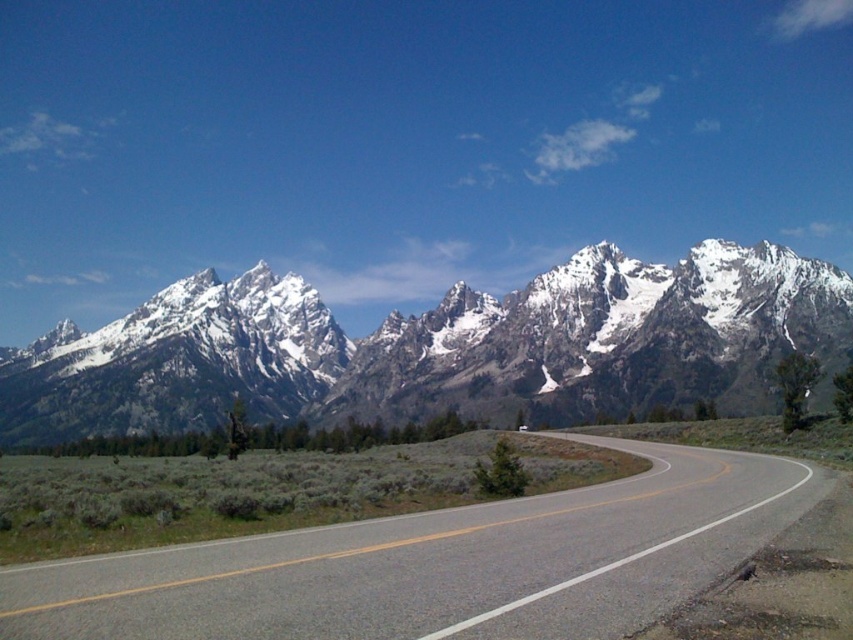
Question: Which point is closer to the camera?

Choices:
 (A) asphalt road at center
 (B) snowy granite mountain range at upper center

Answer: (A)

Question: Does snowy granite mountain range at upper center appear on the right side of asphalt road at center?

Choices:
 (A) no
 (B) yes

Answer: (A)

Question: Does snowy granite mountain range at upper center have a larger size compared to asphalt road at center?

Choices:
 (A) yes
 (B) no

Answer: (A)

Question: Which object is farther from the camera taking this photo?

Choices:
 (A) snowy granite mountain range at upper center
 (B) asphalt road at center

Answer: (A)

Question: From the image, what is the correct spatial relationship of snowy granite mountain range at upper center in relation to asphalt road at center?

Choices:
 (A) right
 (B) left

Answer: (B)